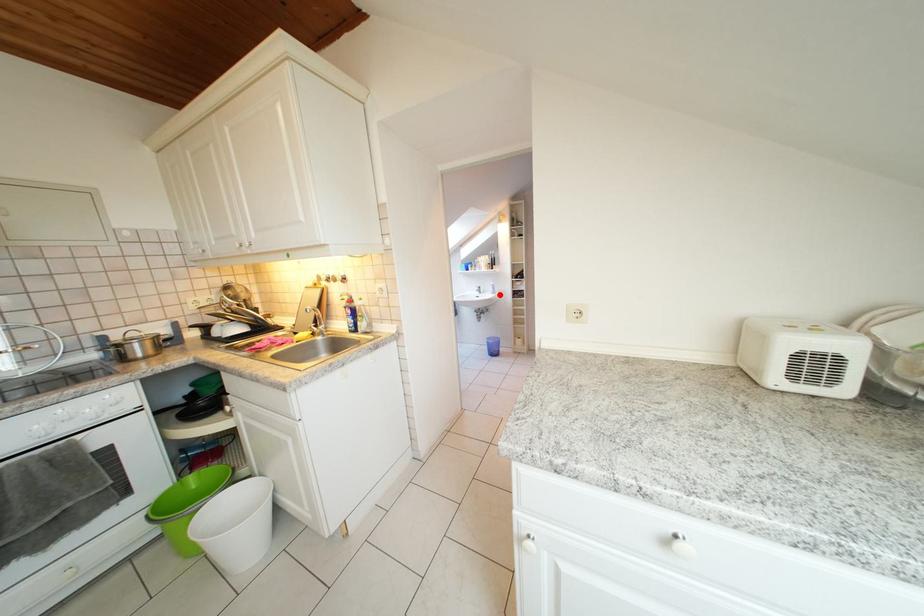
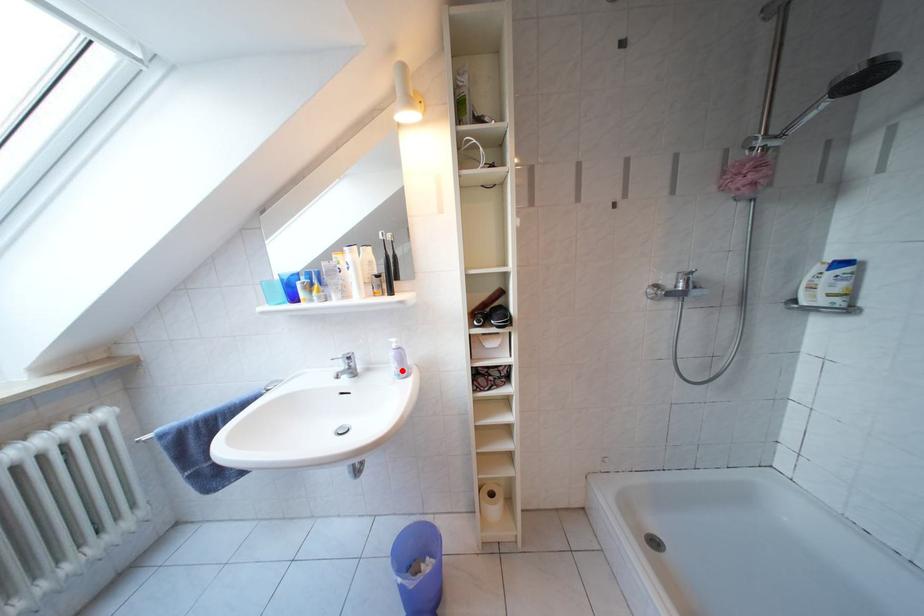
From the picture: I am providing you with two images of the same scene from different viewpoints. A red point is marked on the first image and another point is marked on the second image. Is the marked point in image1 the same physical position as the marked point in image2?

Yes